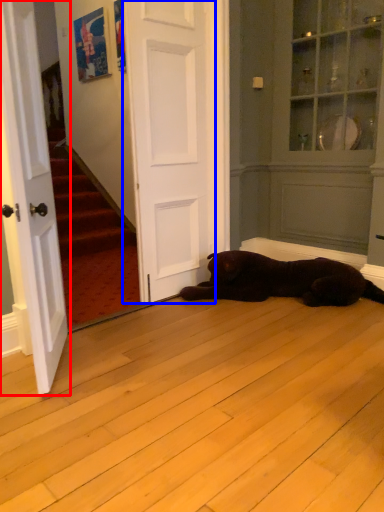
Question: Which object is closer to the camera taking this photo, door (highlighted by a red box) or door (highlighted by a blue box)?

Choices:
 (A) door
 (B) door

Answer: (A)